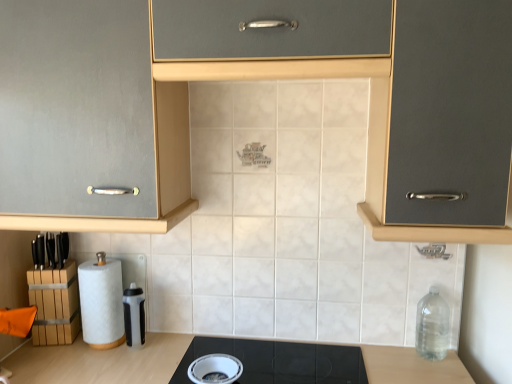
Measure the distance between point (x=190, y=377) and camera.

Point (x=190, y=377) and camera are 1.30 meters apart.

Locate an element on the screen. This screenshot has height=384, width=512. white glossy bowl at lower center, which ranks as the 2th appliance in back-to-front order is located at coordinates (215, 369).

Describe the element at coordinates (134, 316) in the screenshot. I see `translucent plastic water bottle at lower center, which appears as the 1th appliance when viewed from the back` at that location.

This screenshot has height=384, width=512. I want to click on matte gray cabinet at center, so click(x=258, y=78).

Describe the element at coordinates (101, 302) in the screenshot. I see `white matte paper towel at lower left` at that location.

The width and height of the screenshot is (512, 384). Identify the location of clear plastic bottle at right. (432, 326).

This screenshot has width=512, height=384. In order to click on paper towel that appears on the left of white glossy bowl at lower center, which ranks as the 2th appliance in back-to-front order in this screenshot , I will do `click(101, 302)`.

Which of these two, white glossy bowl at lower center, which is the 2th appliance in top-to-bottom order, or white matte paper towel at lower left, stands taller?

white matte paper towel at lower left.

Can you tell me how much white glossy bowl at lower center, marked as the second appliance in a left-to-right arrangement, and white matte paper towel at lower left differ in facing direction?

There is a 0.464-degree angle between the facing directions of white glossy bowl at lower center, marked as the second appliance in a left-to-right arrangement, and white matte paper towel at lower left.

From a real-world perspective, which is physically above, white matte paper towel at lower left or black glass cooktop at center?

white matte paper towel at lower left is physically above.

Is white matte paper towel at lower left positioned in front of black glass cooktop at center?

No, white matte paper towel at lower left is behind black glass cooktop at center.

Based on their sizes in the image, would you say white matte paper towel at lower left is bigger or smaller than black glass cooktop at center?

Clearly, white matte paper towel at lower left is smaller in size than black glass cooktop at center.

Could you tell me if white matte paper towel at lower left is facing black glass cooktop at center?

No, white matte paper towel at lower left is not turned towards black glass cooktop at center.

The image size is (512, 384). Find the location of `bottle below the matte gray cabinet at center (from the image's perspective)`. bottle below the matte gray cabinet at center (from the image's perspective) is located at coordinates (432, 326).

Looking at this image, is matte gray cabinet at center behind clear plastic bottle at right?

No, it is not.

Considering the sizes of matte gray cabinet at center and clear plastic bottle at right in the image, is matte gray cabinet at center bigger or smaller than clear plastic bottle at right?

Considering their sizes, matte gray cabinet at center takes up more space than clear plastic bottle at right.

Is matte gray cabinet at center not within clear plastic bottle at right?

matte gray cabinet at center lies outside clear plastic bottle at right's area.

Which object is positioned more to the right, matte gray cabinet at center or white matte paper towel at lower left?

From the viewer's perspective, matte gray cabinet at center appears more on the right side.

Consider the image. Is matte gray cabinet at center aimed at white matte paper towel at lower left?

No, matte gray cabinet at center is not aimed at white matte paper towel at lower left.

From the image's perspective, which is above, matte gray cabinet at center or white matte paper towel at lower left?

matte gray cabinet at center appears higher in the image.

Can you confirm if matte gray cabinet at center is shorter than white matte paper towel at lower left?

In fact, matte gray cabinet at center may be taller than white matte paper towel at lower left.

Is matte gray cabinet at center closer to the viewer compared to white glossy bowl at lower center, which is counted as the 1th appliance, starting from the bottom?

Yes, it is.

Considering the relative sizes of matte gray cabinet at center and white glossy bowl at lower center, which is counted as the 1th appliance, starting from the bottom, in the image provided, is matte gray cabinet at center shorter than white glossy bowl at lower center, which is counted as the 1th appliance, starting from the bottom,?

No.

From the image's perspective, would you say matte gray cabinet at center is shown under white glossy bowl at lower center, which is counted as the 1th appliance, starting from the bottom?

Actually, matte gray cabinet at center appears above white glossy bowl at lower center, which is counted as the 1th appliance, starting from the bottom, in the image.

Is matte gray cabinet at center outside of white glossy bowl at lower center, which is the 2th appliance in top-to-bottom order?

That's correct, matte gray cabinet at center is outside of white glossy bowl at lower center, which is the 2th appliance in top-to-bottom order.

Which object is positioned more to the right, translucent plastic water bottle at lower center, the first appliance when ordered from left to right, or matte gray cabinet at center?

From the viewer's perspective, matte gray cabinet at center appears more on the right side.

Can you confirm if translucent plastic water bottle at lower center, the 2th appliance in the right-to-left sequence, is thinner than matte gray cabinet at center?

Yes.

Is translucent plastic water bottle at lower center, the second appliance from the bottom, not inside matte gray cabinet at center?

That's correct, translucent plastic water bottle at lower center, the second appliance from the bottom, is outside of matte gray cabinet at center.

Considering the sizes of objects translucent plastic water bottle at lower center, the first appliance when ordered from left to right, and matte gray cabinet at center in the image provided, who is smaller, translucent plastic water bottle at lower center, the first appliance when ordered from left to right, or matte gray cabinet at center?

Smaller between the two is translucent plastic water bottle at lower center, the first appliance when ordered from left to right.

Which is correct: clear plastic bottle at right is inside black glass cooktop at center, or outside of it?

The correct answer is: outside.

Does clear plastic bottle at right turn towards black glass cooktop at center?

No, clear plastic bottle at right is not facing towards black glass cooktop at center.

From a real-world perspective, does clear plastic bottle at right sit lower than black glass cooktop at center?

Incorrect, from a real-world perspective, clear plastic bottle at right is higher than black glass cooktop at center.

From the white matte paper towel at lower left, count 2nd appliance to the right and point to it. Please provide its 2D coordinates.

[(215, 369)]

The width and height of the screenshot is (512, 384). What are the coordinates of `gas stove below the white matte paper towel at lower left (from a real-world perspective)` in the screenshot? It's located at [280, 361].

Which object lies nearer to the anchor point white glossy bowl at lower center, which is counted as the 1th appliance, starting from the bottom, black glass cooktop at center or clear plastic bottle at right?

The object closer to white glossy bowl at lower center, which is counted as the 1th appliance, starting from the bottom, is black glass cooktop at center.

Considering their positions, is matte gray cabinet at center positioned closer to clear plastic bottle at right than white glossy bowl at lower center, which is the 2th appliance in top-to-bottom order?

white glossy bowl at lower center, which is the 2th appliance in top-to-bottom order.

Considering their positions, is clear plastic bottle at right positioned further to translucent plastic water bottle at lower center, the first appliance when ordered from left to right, than black glass cooktop at center?

Among the two, clear plastic bottle at right is located further to translucent plastic water bottle at lower center, the first appliance when ordered from left to right.

When comparing their distances from clear plastic bottle at right, does matte gray cabinet at center or white matte paper towel at lower left seem further?

white matte paper towel at lower left is further to clear plastic bottle at right.

Estimate the real-world distances between objects in this image. Which object is further from white matte paper towel at lower left, translucent plastic water bottle at lower center, the first appliance when ordered from left to right, or matte gray cabinet at center?

Among the two, matte gray cabinet at center is located further to white matte paper towel at lower left.

When comparing their distances from white matte paper towel at lower left, does clear plastic bottle at right or translucent plastic water bottle at lower center, placed as the first appliance when sorted from top to bottom, seem further?

Based on the image, clear plastic bottle at right appears to be further to white matte paper towel at lower left.

Looking at this image, estimate the real-world distances between objects in this image. Which object is closer to matte gray cabinet at center, black glass cooktop at center or clear plastic bottle at right?

black glass cooktop at center.

From the picture: From the image, which object appears to be nearer to matte gray cabinet at center, white glossy bowl at lower center, marked as the first appliance in a right-to-left arrangement, or clear plastic bottle at right?

white glossy bowl at lower center, marked as the first appliance in a right-to-left arrangement, is positioned closer to the anchor matte gray cabinet at center.

Identify the location of paper towel between matte gray cabinet at center and black glass cooktop at center vertically. (101, 302).

The width and height of the screenshot is (512, 384). Identify the location of paper towel that lies between matte gray cabinet at center and white glossy bowl at lower center, which is the 2th appliance in top-to-bottom order, from top to bottom. (101, 302).

At what (x,y) coordinates should I click in order to perform the action: click on bottle between matte gray cabinet at center and black glass cooktop at center vertically. Please return your answer as a coordinate pair (x, y). Looking at the image, I should click on (432, 326).

Locate an element on the screen. The height and width of the screenshot is (384, 512). gas stove between white matte paper towel at lower left and clear plastic bottle at right in the horizontal direction is located at coordinates (280, 361).